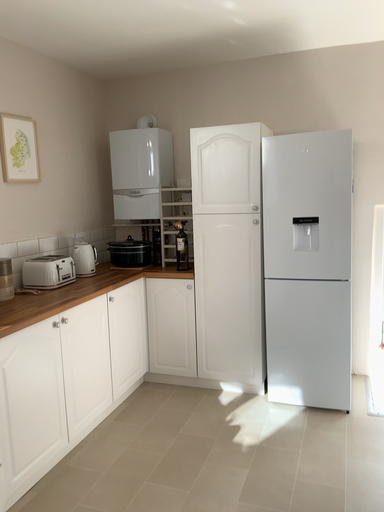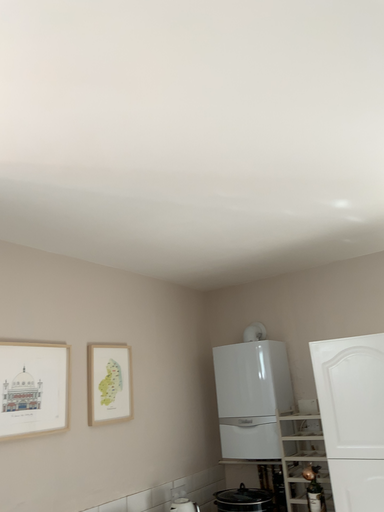
Question: Which way did the camera rotate in the video?

Choices:
 (A) rotated left
 (B) rotated right

Answer: (A)